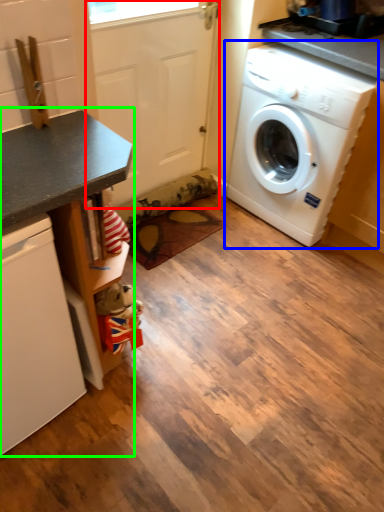
Question: Which is farther away from screen door (highlighted by a red box)? washing machine (highlighted by a blue box) or counter (highlighted by a green box)?

Choices:
 (A) washing machine
 (B) counter

Answer: (B)